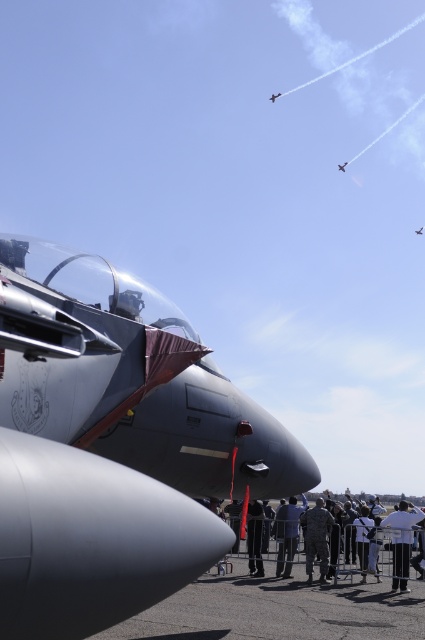
Who is more distant from viewer, (95,333) or (416,230)?

Point (416,230)

Between point (121, 404) and point (422, 228), which one is positioned in front?

Positioned in front is point (121, 404).

You are a GUI agent. You are given a task and a screenshot of the screen. Output one action in this format:
    pyautogui.click(x=<x>, y=<y>)
    Task: Click on the matte gray jet at center
    
    Given the screenshot: What is the action you would take?
    pyautogui.click(x=113, y=445)

Does black fabric pants at lower center have a greater width compared to metallic silver airplane at upper center?

Incorrect, black fabric pants at lower center's width does not surpass metallic silver airplane at upper center's.

In the scene shown: Is black fabric pants at lower center thinner than metallic silver airplane at upper center?

Yes.

I want to click on black fabric pants at lower center, so click(255, 538).

Can you confirm if white fabric shirt at lower right is thinner than matte gray jet at upper center?

Yes.

How distant is white fabric shirt at lower right from matte gray jet at upper center?

white fabric shirt at lower right and matte gray jet at upper center are 69.71 feet apart from each other.

Between point (405, 518) and point (419, 230), which one is positioned behind?

Positioned behind is point (419, 230).

Where is `white fabric shirt at lower right`? This screenshot has height=640, width=425. white fabric shirt at lower right is located at coordinates (402, 541).